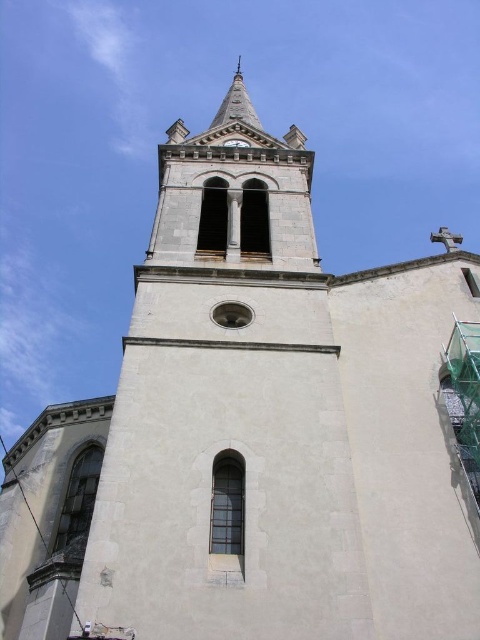
You are an architect examining the church tower. You notice the white stone spire at upper center and the dark brown wooden clock at center. Based on their positions, which object is closer to the top of the tower?

The white stone spire at upper center is closer to the top of the tower than the dark brown wooden clock at center because the spire is positioned higher up.

You are standing in front of the church tower and want to take a photo of the dark brown wooden clock at center without the white stone spire at upper center blocking it. How should you adjust your position?

The dark brown wooden clock at center is behind the white stone spire at upper center, so to avoid the spire blocking the clock, you should move to the side so that the spire is no longer directly in front of the clock in your view.

You are an architect inspecting the church tower. You need to determine the spatial relationship between the white stone spire at upper center and the dark brown wooden clock at center. Which object is located to the left of the other?

The white stone spire at upper center is positioned on the left side of dark brown wooden clock at center.